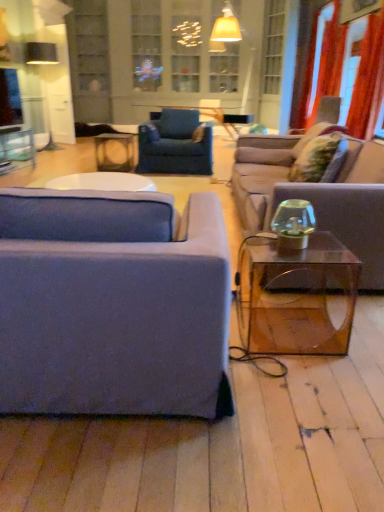
Question: From the image's perspective, is matte blue fabric couch at left, placed as the first studio couch when sorted from front to back, located above or below velvet blue armchair at center?

Choices:
 (A) above
 (B) below

Answer: (B)

Question: From a real-world perspective, is matte blue fabric couch at left, which is counted as the first studio couch, starting from the left, above or below velvet blue armchair at center?

Choices:
 (A) below
 (B) above

Answer: (A)

Question: Based on their relative distances, which object is nearer to the red velvet curtain at upper right, marked as the second curtain in a front-to-back arrangement?

Choices:
 (A) transparent acrylic coffee table at right
 (B) transparent glass window screen at upper left
 (C) clear glass cabinet at upper center
 (D) transparent glass studio couch at right, positioned as the 2th studio couch in front-to-back order
 (E) velvet blue armchair at center

Answer: (D)

Question: Estimate the real-world distances between objects in this image. Which object is closer to the matte glass table at center, arranged as the 2th table when viewed from the left?

Choices:
 (A) transparent glass window screen at upper left
 (B) orange fabric curtain at upper right, arranged as the second curtain when viewed from the back
 (C) red velvet curtain at upper right, acting as the first curtain starting from the back
 (D) clear glass table at upper left, which appears as the second table when viewed from the right
 (E) velvet blue armchair at center

Answer: (E)